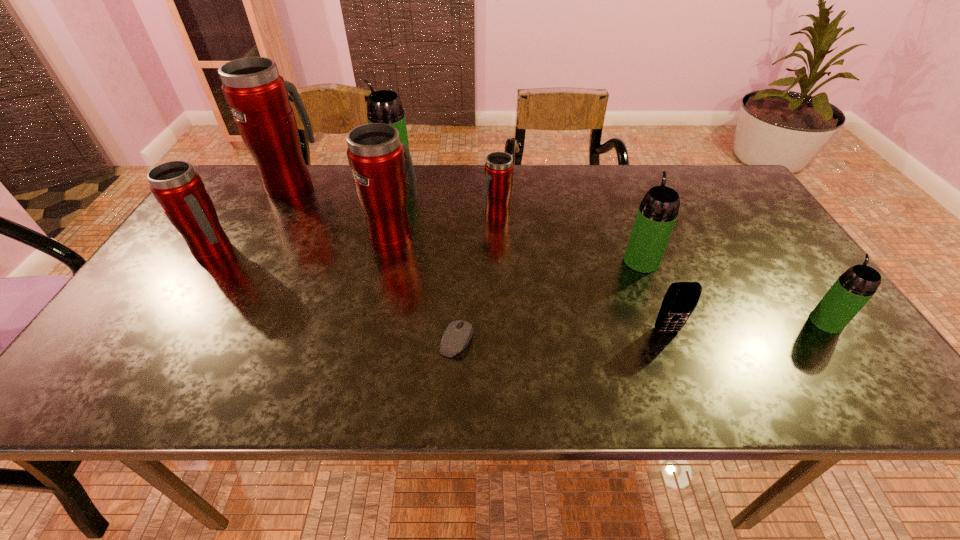
The image size is (960, 540). What are the coordinates of `free space located 0.080m on the side with the handle of the second biggest red thermos bottle` in the screenshot? It's located at (400, 202).

Locate an element on the screen. vacant space situated 0.140m from the spout of the second nearest green thermos bottle is located at coordinates (624, 217).

Locate an element on the screen. free space located 0.270m from the spout of the second nearest green thermos bottle is located at coordinates (614, 191).

You are a GUI agent. You are given a task and a screenshot of the screen. Output one action in this format:
    pyautogui.click(x=<x>, y=<y>)
    Task: Click on the free space located from the spout of the second nearest green thermos bottle
    
    Given the screenshot: What is the action you would take?
    pyautogui.click(x=612, y=185)

The image size is (960, 540). Find the location of `free space located 0.180m on the side with the handle of the second smallest red thermos bottle`. free space located 0.180m on the side with the handle of the second smallest red thermos bottle is located at coordinates (307, 252).

Locate an element on the screen. This screenshot has width=960, height=540. vacant space located from the spout of the smallest green thermos bottle is located at coordinates (750, 214).

You are a GUI agent. You are given a task and a screenshot of the screen. Output one action in this format:
    pyautogui.click(x=<x>, y=<y>)
    Task: Click on the free space located 0.360m from the spout of the smallest green thermos bottle
    This screenshot has width=960, height=540.
    Given the screenshot: What is the action you would take?
    pyautogui.click(x=750, y=214)

Where is `free space located from the spout of the smallest green thermos bottle`? The image size is (960, 540). free space located from the spout of the smallest green thermos bottle is located at coordinates (759, 228).

The width and height of the screenshot is (960, 540). Find the location of `vacant region located on the side with the handle of the smallest red thermos bottle`. vacant region located on the side with the handle of the smallest red thermos bottle is located at coordinates (502, 338).

Where is `free space located on the screen of the second shortest object`? The width and height of the screenshot is (960, 540). free space located on the screen of the second shortest object is located at coordinates (685, 380).